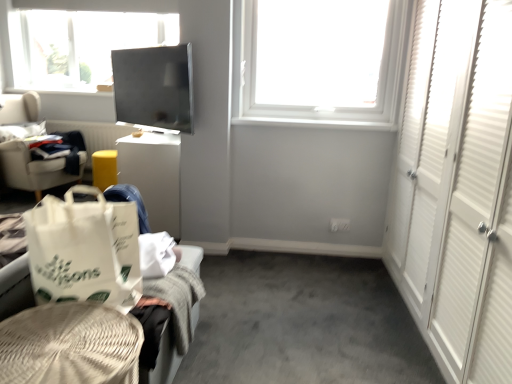
Question: Would you say white cardboard box at center-left is part of woven beige basket at lower left, marked as the 1th furniture in a front-to-back arrangement,'s contents?

Choices:
 (A) no
 (B) yes

Answer: (A)

Question: Is woven beige basket at lower left, marked as the 1th furniture in a front-to-back arrangement, positioned beyond the bounds of white cardboard box at center-left?

Choices:
 (A) yes
 (B) no

Answer: (A)

Question: Is woven beige basket at lower left, marked as the 1th furniture in a front-to-back arrangement, facing towards white cardboard box at center-left?

Choices:
 (A) yes
 (B) no

Answer: (B)

Question: Does woven beige basket at lower left, marked as the 1th furniture in a front-to-back arrangement, have a greater height compared to white cardboard box at center-left?

Choices:
 (A) no
 (B) yes

Answer: (A)

Question: From a real-world perspective, is woven beige basket at lower left, marked as the 1th furniture in a front-to-back arrangement, beneath white cardboard box at center-left?

Choices:
 (A) yes
 (B) no

Answer: (A)

Question: Is white plastic window at upper center taller or shorter than woven beige basket at lower left, marked as the 1th furniture in a front-to-back arrangement?

Choices:
 (A) short
 (B) tall

Answer: (B)

Question: From a real-world perspective, relative to woven beige basket at lower left, acting as the 2th furniture starting from the back, is white plastic window at upper center vertically above or below?

Choices:
 (A) below
 (B) above

Answer: (B)

Question: Relative to woven beige basket at lower left, marked as the 1th furniture in a front-to-back arrangement, is white plastic window at upper center in front or behind?

Choices:
 (A) behind
 (B) front

Answer: (A)

Question: Considering the positions of white plastic window at upper center and woven beige basket at lower left, acting as the 2th furniture starting from the back, in the image, is white plastic window at upper center wider or thinner than woven beige basket at lower left, acting as the 2th furniture starting from the back,?

Choices:
 (A) thin
 (B) wide

Answer: (A)

Question: Would you say white cardboard box at center-left is to the left or to the right of white plastic window at upper center in the picture?

Choices:
 (A) right
 (B) left

Answer: (B)

Question: Considering the positions of white cardboard box at center-left and white plastic window at upper center in the image, is white cardboard box at center-left bigger or smaller than white plastic window at upper center?

Choices:
 (A) small
 (B) big

Answer: (B)

Question: From the image's perspective, relative to white plastic window at upper center, is white cardboard box at center-left above or below?

Choices:
 (A) above
 (B) below

Answer: (B)

Question: Is point (140, 147) positioned closer to the camera than point (393, 81)?

Choices:
 (A) closer
 (B) farther

Answer: (B)

Question: In terms of height, does white paper shopping bag at lower left look taller or shorter compared to white cardboard box at center-left?

Choices:
 (A) tall
 (B) short

Answer: (B)

Question: Is white paper shopping bag at lower left wider or thinner than white cardboard box at center-left?

Choices:
 (A) thin
 (B) wide

Answer: (A)